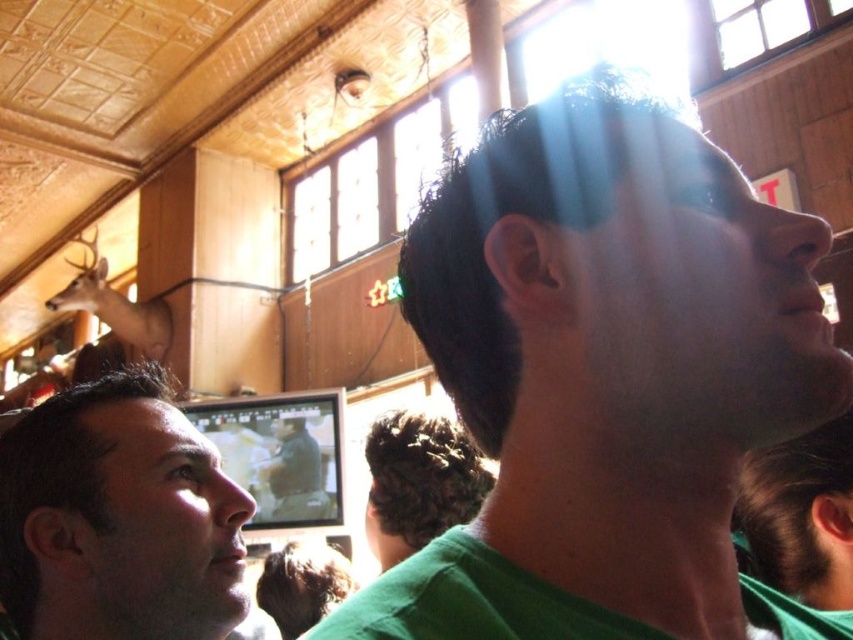
Question: Does matte green shirt at lower left have a smaller size compared to curly hair at center?

Choices:
 (A) no
 (B) yes

Answer: (B)

Question: Can you confirm if matte green shirt at lower left is positioned to the left of matte brown deer at center?

Choices:
 (A) no
 (B) yes

Answer: (A)

Question: Is green matte shirt at upper right to the left of matte brown deer at center from the viewer's perspective?

Choices:
 (A) no
 (B) yes

Answer: (A)

Question: Which of these objects is positioned farthest from the brown matte deer at upper left?

Choices:
 (A) green matte shirt at upper right
 (B) green matte shirt at center
 (C) matte brown deer at center

Answer: (A)

Question: Which of these objects is positioned closest to the matte brown deer at center?

Choices:
 (A) green matte shirt at upper right
 (B) brown matte deer at upper left
 (C) curly hair at center
 (D) green matte shirt at center

Answer: (C)

Question: Which of these objects is positioned closest to the green matte shirt at center?

Choices:
 (A) green matte shirt at upper right
 (B) curly hair at center
 (C) matte green shirt at lower left
 (D) brown matte deer at upper left

Answer: (B)